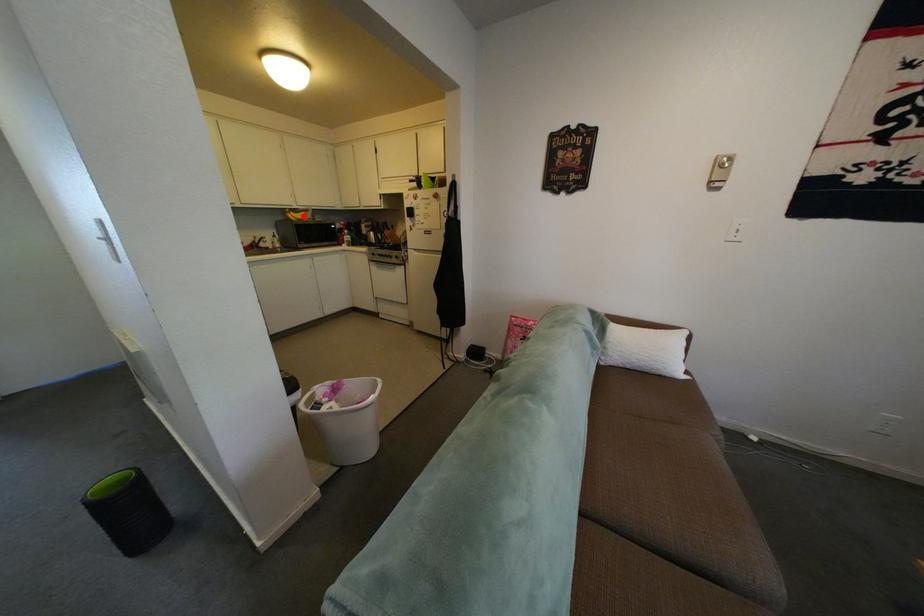
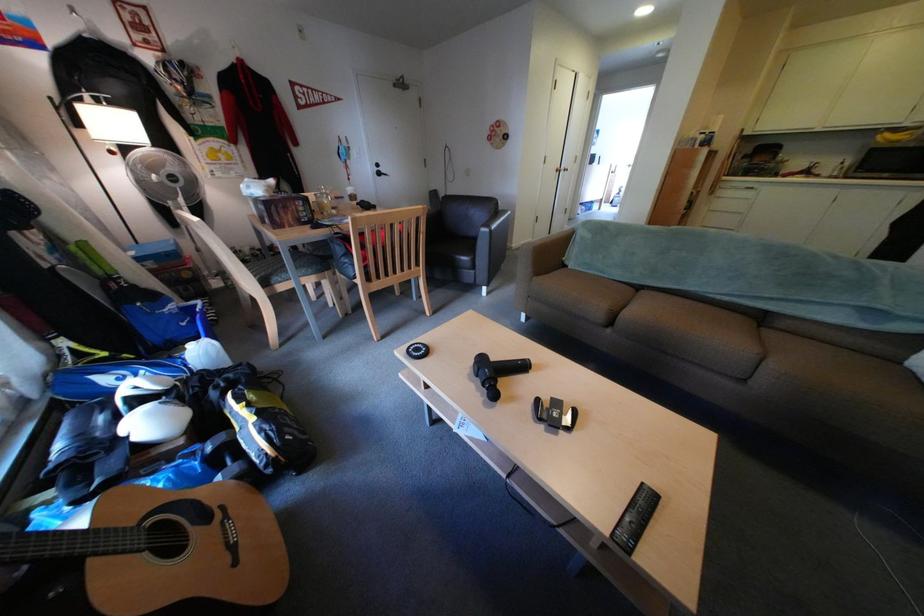
Question: I am providing you with two images of the same scene from different viewpoints. Given a red point in image1, look at the same physical point in image2. Is it:

Choices:
 (A) Closer to the viewpoint
 (B) Farther from the viewpoint

Answer: (B)